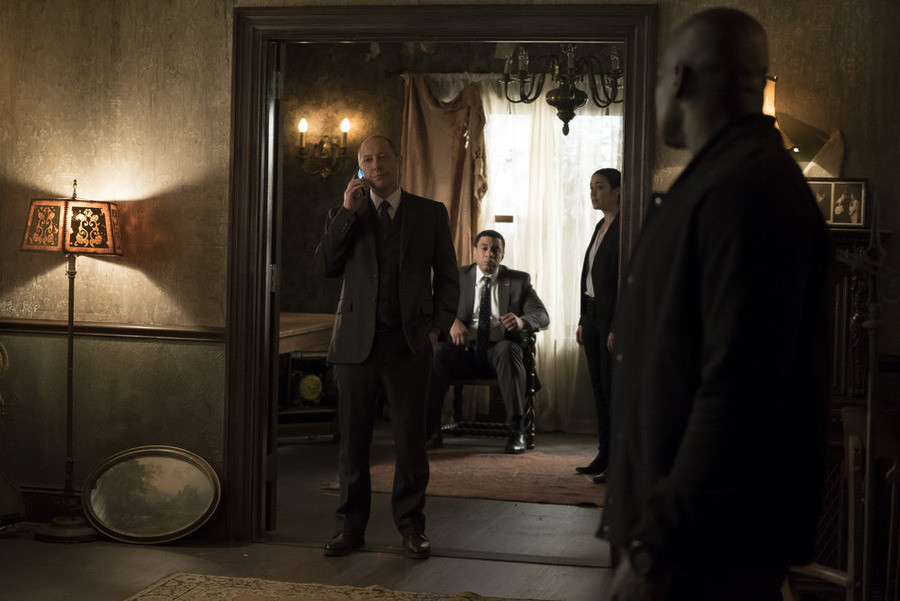
The width and height of the screenshot is (900, 601). I want to click on tray, so click(166, 445).